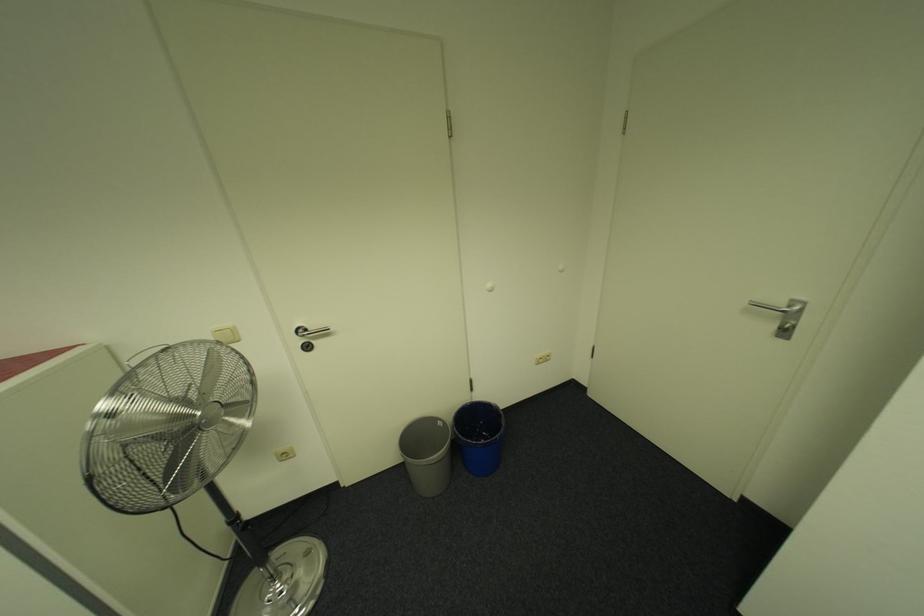
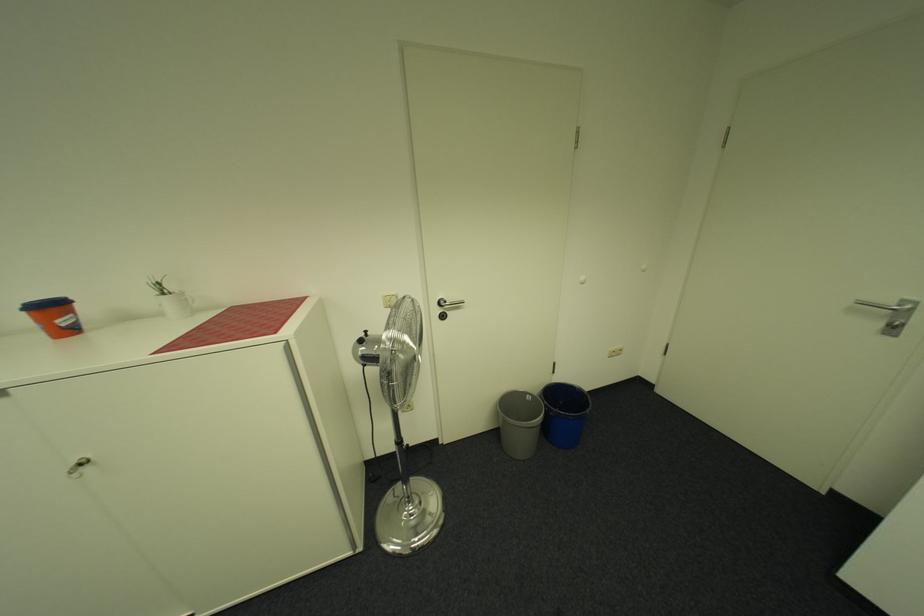
In the second image, find the point that corresponds to the point at 789,304 in the first image.

(898, 302)